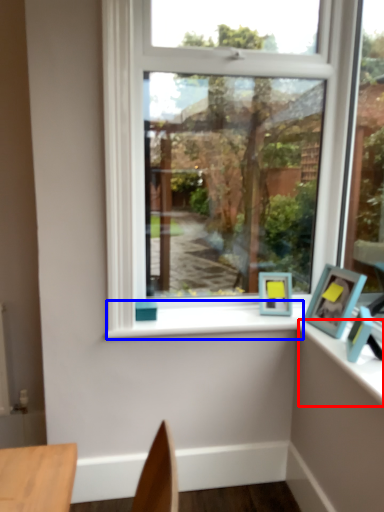
Question: Which point is further to the camera, counter top (highlighted by a red box) or window sill (highlighted by a blue box)?

Choices:
 (A) counter top
 (B) window sill

Answer: (B)